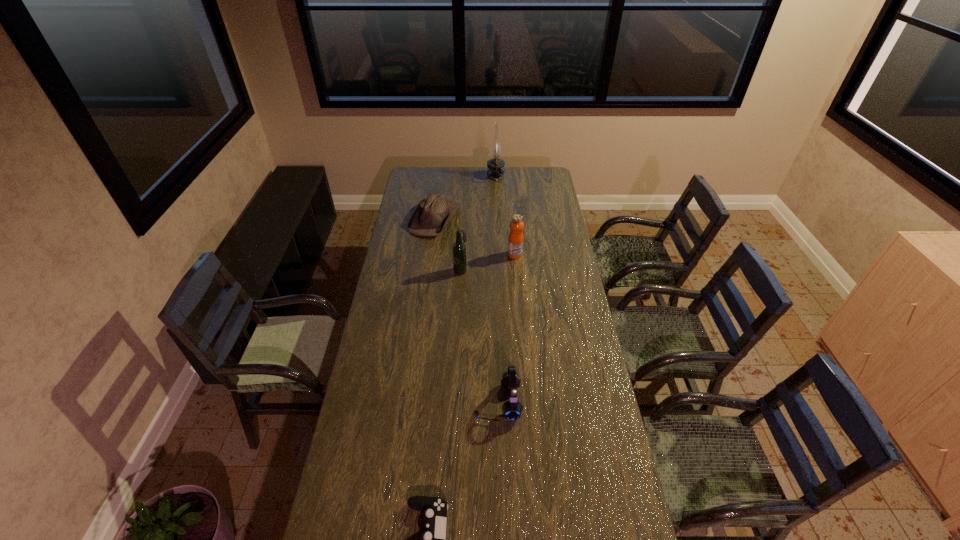
Identify the location of vacant point that satisfies the following two spatial constraints: 1. on the front side of the third farthest object; 2. on the right side of the oil lamp. (499, 255).